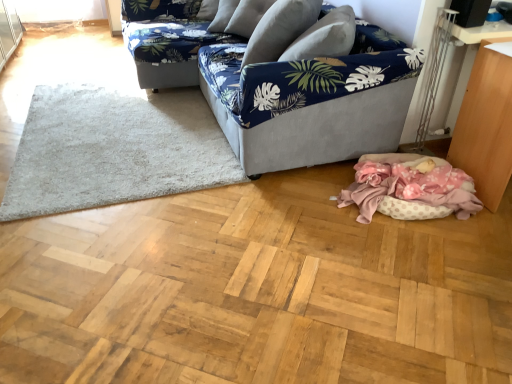
Question: Would you say wooden table at lower right contains blue floral fabric couch at upper center, the 1th studio couch viewed from the back?

Choices:
 (A) no
 (B) yes

Answer: (A)

Question: Could you tell me if wooden table at lower right is facing blue floral fabric couch at upper center, arranged as the second studio couch when viewed from the front?

Choices:
 (A) yes
 (B) no

Answer: (B)

Question: Is wooden table at lower right positioned with its back to blue floral fabric couch at upper center, the 1th studio couch viewed from the back?

Choices:
 (A) no
 (B) yes

Answer: (A)

Question: Is wooden table at lower right positioned before blue floral fabric couch at upper center, arranged as the second studio couch when viewed from the front?

Choices:
 (A) no
 (B) yes

Answer: (B)

Question: Considering the relative sizes of wooden table at lower right and blue floral fabric couch at upper center, the 1th studio couch viewed from the back, in the image provided, is wooden table at lower right shorter than blue floral fabric couch at upper center, the 1th studio couch viewed from the back,?

Choices:
 (A) yes
 (B) no

Answer: (B)

Question: From the image's perspective, relative to navy blue fabric couch at center, which is the 2th studio couch in back-to-front order, is white shaggy rug at lower left above or below?

Choices:
 (A) above
 (B) below

Answer: (B)

Question: Is white shaggy rug at lower left bigger or smaller than navy blue fabric couch at center, which is the 2th studio couch in back-to-front order?

Choices:
 (A) small
 (B) big

Answer: (A)

Question: In the image, is white shaggy rug at lower left positioned in front of or behind navy blue fabric couch at center, marked as the 1th studio couch in a front-to-back arrangement?

Choices:
 (A) behind
 (B) front

Answer: (A)

Question: In terms of height, does white shaggy rug at lower left look taller or shorter compared to navy blue fabric couch at center, which is the 2th studio couch in back-to-front order?

Choices:
 (A) tall
 (B) short

Answer: (B)

Question: Looking at their shapes, would you say navy blue fabric couch at center, marked as the 1th studio couch in a front-to-back arrangement, is wider or thinner than blue fabric pillow at center?

Choices:
 (A) thin
 (B) wide

Answer: (B)

Question: Is navy blue fabric couch at center, which is the 2th studio couch in back-to-front order, in front of or behind blue fabric pillow at center in the image?

Choices:
 (A) behind
 (B) front

Answer: (B)

Question: Looking at the image, does navy blue fabric couch at center, marked as the 1th studio couch in a front-to-back arrangement, seem bigger or smaller compared to blue fabric pillow at center?

Choices:
 (A) small
 (B) big

Answer: (B)

Question: From a real-world perspective, is navy blue fabric couch at center, which is the 2th studio couch in back-to-front order, above or below blue fabric pillow at center?

Choices:
 (A) above
 (B) below

Answer: (B)

Question: Is point (487, 193) closer or farther from the camera than point (147, 46)?

Choices:
 (A) closer
 (B) farther

Answer: (A)

Question: From their relative heights in the image, would you say wooden table at lower right is taller or shorter than blue floral fabric couch at upper center, arranged as the second studio couch when viewed from the front?

Choices:
 (A) short
 (B) tall

Answer: (B)